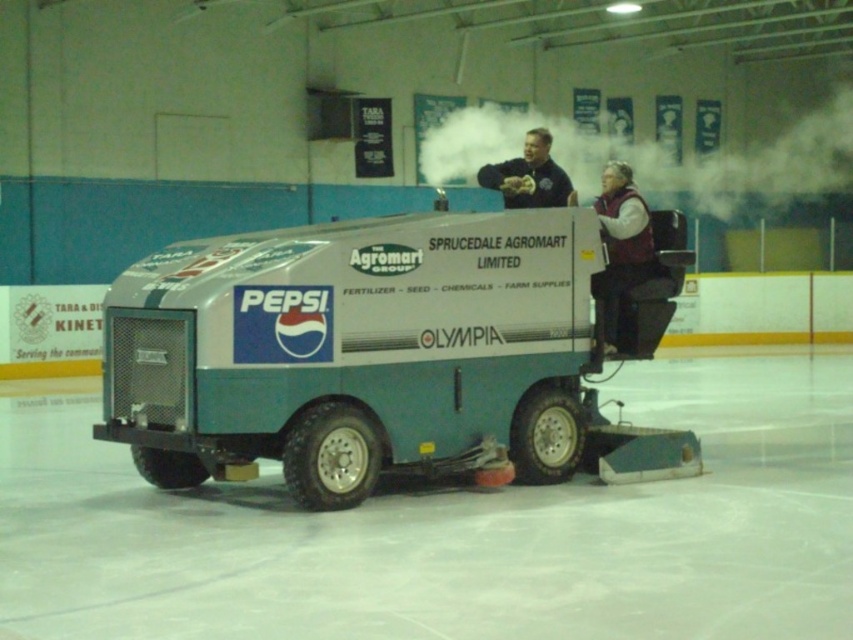
You are a spectator at the ice rink and want to locate the operator of the ice resurfacing machine. According to the scene, which individual is positioned closer to you between the maroon fleece vest at center and the dark blue jacket at upper center?

The maroon fleece vest at center is in front of the dark blue jacket at upper center, so the operator wearing the maroon fleece vest at center is closer to you.

You are a maintenance worker needing to reach the control panel located at the front of the ice resurfacing machine. The control panel is 24 inches away from the dark blue jacket at upper center. Can you comfortably reach it from your current position wearing the maroon fleece vest at center?

The maroon fleece vest at center is 22.92 inches away from the dark blue jacket at upper center. Since the control panel is 24 inches away from the dark blue jacket, the distance between you and the control panel would be approximately 22.92 inches plus 24 inches, totaling 46.92 inches. This distance may be too far to comfortably reach without moving closer.